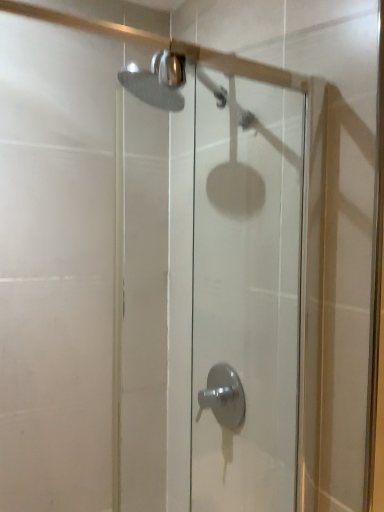
Question: Should I look upward or downward to see satin nickel faucet at lower center?

Choices:
 (A) up
 (B) down

Answer: (B)